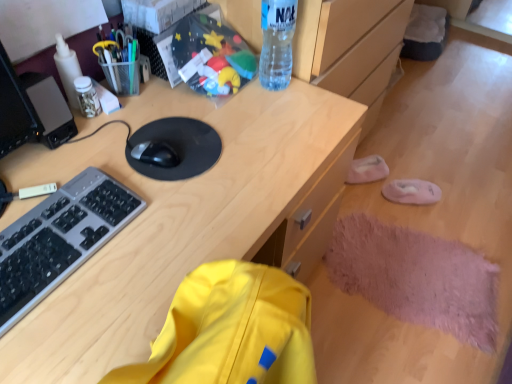
In order to face white plastic bottle at upper left, which ranks as the first bottle in left-to-right order, should I rotate leftwards or rightwards?

It's best to rotate left around 23.151 degrees.

In order to face transparent plastic bottle at upper center, positioned as the first bottle in right-to-left order, should I rotate leftwards or rightwards?

You should rotate right by 3.201 degrees.

At what (x,y) coordinates should I click in order to perform the action: click on transparent plastic bottle at upper center, positioned as the first bottle in right-to-left order. Please return your answer as a coordinate pair (x, y). The width and height of the screenshot is (512, 384). Looking at the image, I should click on (277, 43).

Identify the location of translucent plastic jar at upper left, which is counted as the 2th stationery, starting from the right. The height and width of the screenshot is (384, 512). (87, 97).

Where is `black matte mouse at center`? black matte mouse at center is located at coordinates (155, 154).

Image resolution: width=512 pixels, height=384 pixels. I want to click on wooden desk at center, so click(x=182, y=218).

Locate an element on the screen. This screenshot has width=512, height=384. white plastic bottle at upper left, the 2th bottle from the right is located at coordinates (67, 69).

From a real-world perspective, does white plastic bottle at upper left, the 2th bottle from the right, stand above black matte mouse at center?

Yes, from a real-world perspective, white plastic bottle at upper left, the 2th bottle from the right, is above black matte mouse at center.

Is white plastic bottle at upper left, which ranks as the first bottle in left-to-right order, positioned with its back to black matte mouse at center?

No, white plastic bottle at upper left, which ranks as the first bottle in left-to-right order, is not facing the opposite direction of black matte mouse at center.

Is the surface of white plastic bottle at upper left, which ranks as the first bottle in left-to-right order, in direct contact with black matte mouse at center?

No, white plastic bottle at upper left, which ranks as the first bottle in left-to-right order, is not next to black matte mouse at center.

Is white plastic bottle at upper left, which ranks as the first bottle in left-to-right order, positioned behind black matte mouse at center?

Yes, it is.

Does wooden desk at center appear on the right side of black matte mousepad at center?

No.

Does point (96, 344) come farther from viewer compared to point (180, 158)?

No, (96, 344) is closer to viewer.

From a real-world perspective, between wooden desk at center and black matte mousepad at center, who is vertically lower?

wooden desk at center.

Between white plastic bottle at upper left, which ranks as the first bottle in left-to-right order, and wooden desk at center, which one has larger size?

wooden desk at center.

Is white plastic bottle at upper left, which ranks as the first bottle in left-to-right order, directly adjacent to wooden desk at center?

No, white plastic bottle at upper left, which ranks as the first bottle in left-to-right order, is not making contact with wooden desk at center.

Considering the positions of objects white plastic bottle at upper left, the 2th bottle from the right, and wooden desk at center in the image provided, who is more to the left, white plastic bottle at upper left, the 2th bottle from the right, or wooden desk at center?

white plastic bottle at upper left, the 2th bottle from the right.

From a real-world perspective, which bottle is the 1st one above the wooden desk at center? Please provide its 2D coordinates.

[(67, 69)]

Which is in front, gray plastic keyboard at left or translucent plastic jar at upper left, positioned as the 1th stationery in left-to-right order?

gray plastic keyboard at left.

In terms of width, does gray plastic keyboard at left look wider or thinner when compared to translucent plastic jar at upper left, positioned as the 1th stationery in left-to-right order?

Clearly, gray plastic keyboard at left has more width compared to translucent plastic jar at upper left, positioned as the 1th stationery in left-to-right order.

From the image's perspective, is gray plastic keyboard at left under translucent plastic jar at upper left, positioned as the 1th stationery in left-to-right order?

Yes, from the image's perspective, gray plastic keyboard at left is below translucent plastic jar at upper left, positioned as the 1th stationery in left-to-right order.

Is gray plastic keyboard at left completely or partially outside of translucent plastic jar at upper left, positioned as the 1th stationery in left-to-right order?

Yes, gray plastic keyboard at left is located beyond the bounds of translucent plastic jar at upper left, positioned as the 1th stationery in left-to-right order.

You are a GUI agent. You are given a task and a screenshot of the screen. Output one action in this format:
    pyautogui.click(x=<x>, y=<y>)
    Task: Click on the computer keyboard directly beneath the metallic pen holder at upper left, the second stationery viewed from the left (from a real-world perspective)
    This screenshot has height=384, width=512.
    Given the screenshot: What is the action you would take?
    pyautogui.click(x=59, y=239)

Is gray plastic keyboard at left smaller than metallic pen holder at upper left, positioned as the first stationery in right-to-left order?

Yes.

Is gray plastic keyboard at left surrounding metallic pen holder at upper left, positioned as the first stationery in right-to-left order?

Actually, metallic pen holder at upper left, positioned as the first stationery in right-to-left order, is outside gray plastic keyboard at left.

Is gray plastic keyboard at left shorter than metallic pen holder at upper left, positioned as the first stationery in right-to-left order?

Yes, gray plastic keyboard at left is shorter than metallic pen holder at upper left, positioned as the first stationery in right-to-left order.

Which is nearer, (131, 94) or (186, 137)?

Clearly, point (131, 94) is more distant from the camera than point (186, 137).

Choose the correct answer: Is metallic pen holder at upper left, the second stationery viewed from the left, inside black matte mousepad at center or outside it?

metallic pen holder at upper left, the second stationery viewed from the left, is spatially situated outside black matte mousepad at center.

In the image, is metallic pen holder at upper left, the second stationery viewed from the left, positioned in front of or behind black matte mousepad at center?

In the image, metallic pen holder at upper left, the second stationery viewed from the left, appears behind black matte mousepad at center.

From the image's perspective, relative to black matte mousepad at center, is metallic pen holder at upper left, the second stationery viewed from the left, above or below?

Clearly, from the image's perspective, metallic pen holder at upper left, the second stationery viewed from the left, is above black matte mousepad at center.

Is gray plastic keyboard at left in contact with white plastic bottle at upper left, the 2th bottle from the right?

No, gray plastic keyboard at left is not next to white plastic bottle at upper left, the 2th bottle from the right.

Can you confirm if gray plastic keyboard at left is positioned to the right of white plastic bottle at upper left, which ranks as the first bottle in left-to-right order?

Yes, gray plastic keyboard at left is to the right of white plastic bottle at upper left, which ranks as the first bottle in left-to-right order.

How different are the orientations of gray plastic keyboard at left and white plastic bottle at upper left, the 2th bottle from the right, in degrees?

The angle between the facing direction of gray plastic keyboard at left and the facing direction of white plastic bottle at upper left, the 2th bottle from the right, is 1.48 degrees.

There is a gray plastic keyboard at left. Identify the location of the 1st bottle above it (from a real-world perspective). (67, 69).

Identify the location of the 1st bottle located above the black matte mouse at center (from a real-world perspective). The image size is (512, 384). point(67,69).

Identify the location of desk that appears in front of the black matte mousepad at center. The height and width of the screenshot is (384, 512). (182, 218).

When comparing their distances from wooden desk at center, does gray plastic keyboard at left or translucent plastic jar at upper left, which is counted as the 2th stationery, starting from the right, seem further?

Among the two, translucent plastic jar at upper left, which is counted as the 2th stationery, starting from the right, is located further to wooden desk at center.

Which object lies nearer to the anchor point transparent plastic bottle at upper center, positioned as the first bottle in right-to-left order, black matte mousepad at center or translucent plastic jar at upper left, which is counted as the 2th stationery, starting from the right?

Based on the image, black matte mousepad at center appears to be nearer to transparent plastic bottle at upper center, positioned as the first bottle in right-to-left order.

Considering their positions, is black matte mousepad at center positioned further to black matte mouse at center than wooden desk at center?

wooden desk at center.

From the image, which object appears to be farther from metallic pen holder at upper left, positioned as the first stationery in right-to-left order, black matte mousepad at center or black matte mouse at center?

black matte mouse at center is positioned further to the anchor metallic pen holder at upper left, positioned as the first stationery in right-to-left order.

When comparing their distances from black matte mouse at center, does transparent plastic bottle at upper center, positioned as the first bottle in right-to-left order, or wooden desk at center seem further?

transparent plastic bottle at upper center, positioned as the first bottle in right-to-left order, is positioned further to the anchor black matte mouse at center.

Based on their spatial positions, is wooden desk at center or black matte mousepad at center closer to transparent plastic bottle at upper center, the second bottle in the left-to-right sequence?

black matte mousepad at center is positioned closer to the anchor transparent plastic bottle at upper center, the second bottle in the left-to-right sequence.

From the image, which object appears to be nearer to wooden desk at center, translucent plastic jar at upper left, positioned as the 1th stationery in left-to-right order, or black matte mousepad at center?

Based on the image, black matte mousepad at center appears to be nearer to wooden desk at center.

Estimate the real-world distances between objects in this image. Which object is further from gray plastic keyboard at left, black matte mouse at center or metallic pen holder at upper left, the second stationery viewed from the left?

metallic pen holder at upper left, the second stationery viewed from the left, is positioned further to the anchor gray plastic keyboard at left.

Where is `mousepad between white plastic bottle at upper left, the 2th bottle from the right, and wooden desk at center in the up-down direction`? Image resolution: width=512 pixels, height=384 pixels. mousepad between white plastic bottle at upper left, the 2th bottle from the right, and wooden desk at center in the up-down direction is located at coordinates (177, 147).

Image resolution: width=512 pixels, height=384 pixels. In order to click on mousepad situated between white plastic bottle at upper left, the 2th bottle from the right, and transparent plastic bottle at upper center, the second bottle in the left-to-right sequence, from left to right in this screenshot , I will do `click(177, 147)`.

Locate an element on the screen. The height and width of the screenshot is (384, 512). mouse between metallic pen holder at upper left, the second stationery viewed from the left, and gray plastic keyboard at left, in the vertical direction is located at coordinates (155, 154).

At what (x,y) coordinates should I click in order to perform the action: click on mouse between wooden desk at center and translucent plastic jar at upper left, which is counted as the 2th stationery, starting from the right, from front to back. Please return your answer as a coordinate pair (x, y). This screenshot has width=512, height=384. Looking at the image, I should click on (155, 154).